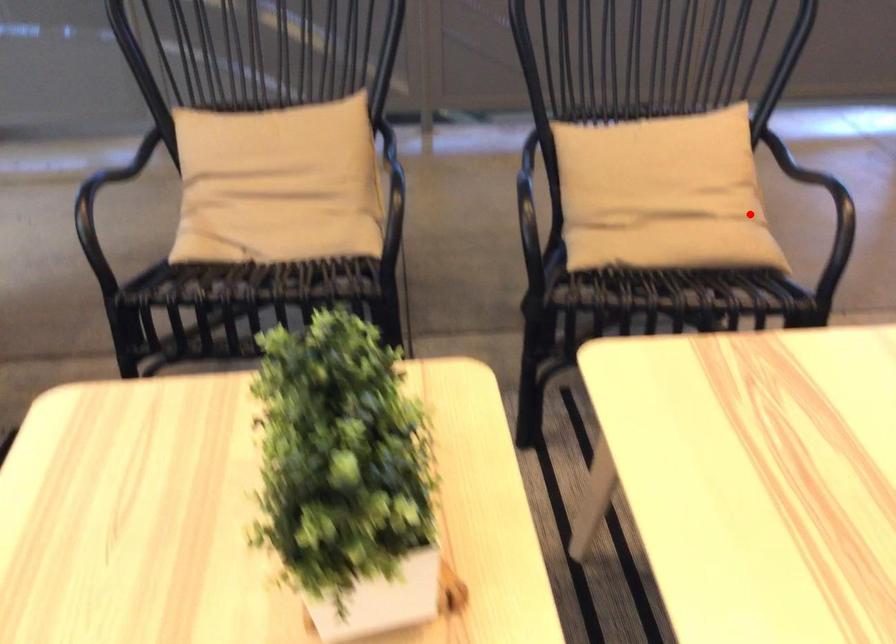
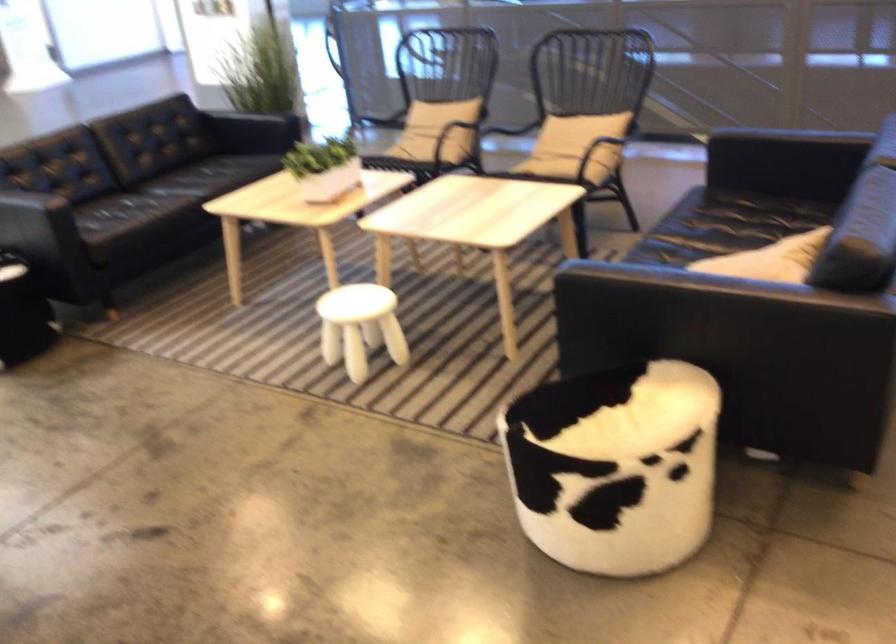
Question: I am providing you with two images of the same scene from different viewpoints. A red point is shown in image1. For the corresponding object point in image2, is it positioned nearer or farther from the camera?

Choices:
 (A) Nearer
 (B) Farther

Answer: (B)